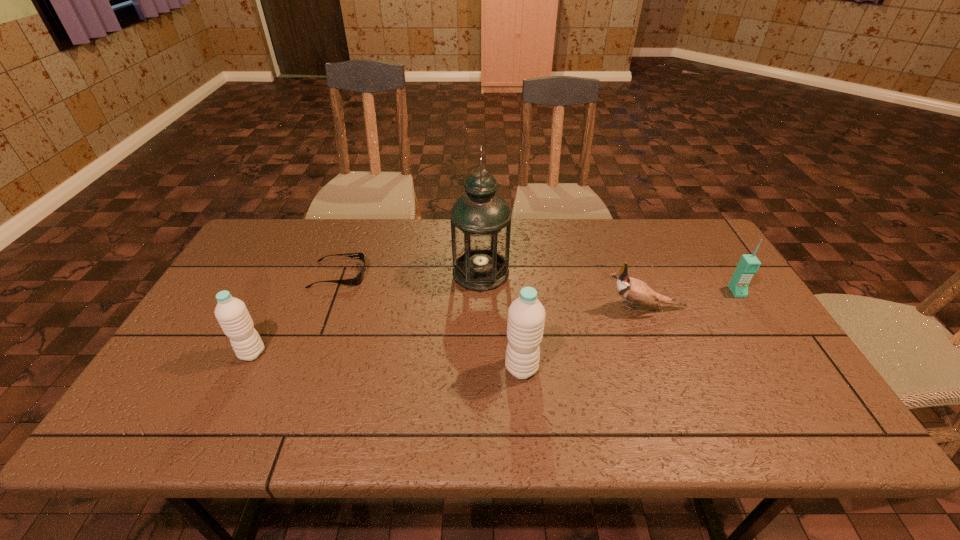
Image resolution: width=960 pixels, height=540 pixels. Find the location of `object that is the closest one to the second object from left to right`. object that is the closest one to the second object from left to right is located at coordinates (231, 313).

This screenshot has width=960, height=540. Identify the location of object that stands as the closest to the left water bottle. (357, 280).

This screenshot has height=540, width=960. Find the location of `vacant space that satisfies the following two spatial constraints: 1. on the back side of the shorter water bottle; 2. on the right side of the oil lamp`. vacant space that satisfies the following two spatial constraints: 1. on the back side of the shorter water bottle; 2. on the right side of the oil lamp is located at coordinates (292, 273).

You are a GUI agent. You are given a task and a screenshot of the screen. Output one action in this format:
    pyautogui.click(x=<x>, y=<y>)
    Task: Click on the free space that satisfies the following two spatial constraints: 1. on the front-facing side of the second object from left to right; 2. on the front side of the shorter water bottle
    The width and height of the screenshot is (960, 540).
    Given the screenshot: What is the action you would take?
    pyautogui.click(x=310, y=353)

Where is `free space that satisfies the following two spatial constraints: 1. on the keypad of the rightmost object; 2. at the face of the bird`? The height and width of the screenshot is (540, 960). free space that satisfies the following two spatial constraints: 1. on the keypad of the rightmost object; 2. at the face of the bird is located at coordinates (747, 308).

Identify the location of free space that satisfies the following two spatial constraints: 1. on the front-facing side of the sunglasses; 2. on the front side of the left water bottle. The height and width of the screenshot is (540, 960). (310, 353).

Locate an element on the screen. The width and height of the screenshot is (960, 540). free space that satisfies the following two spatial constraints: 1. on the front-facing side of the sunglasses; 2. on the left side of the second tallest object is located at coordinates (304, 368).